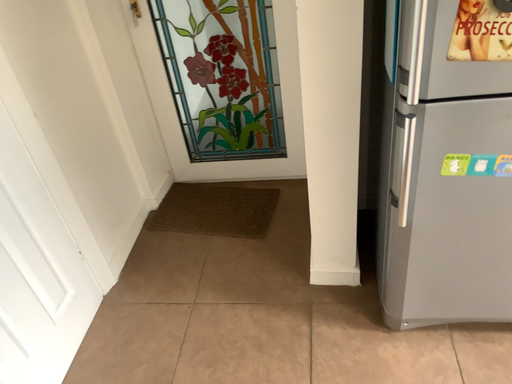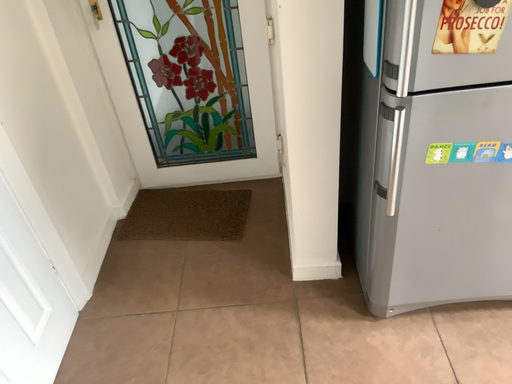
Question: Which way did the camera rotate in the video?

Choices:
 (A) rotated left
 (B) rotated right

Answer: (B)